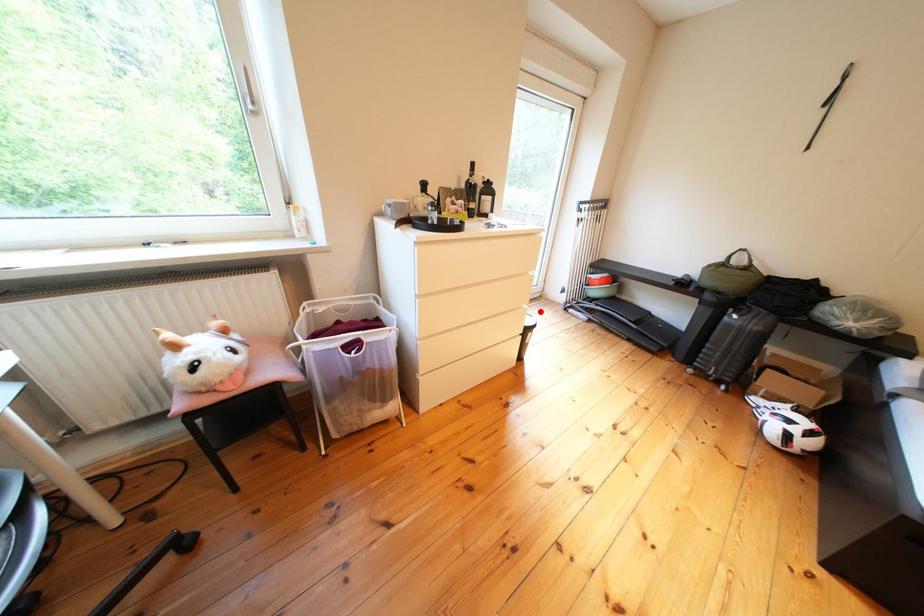
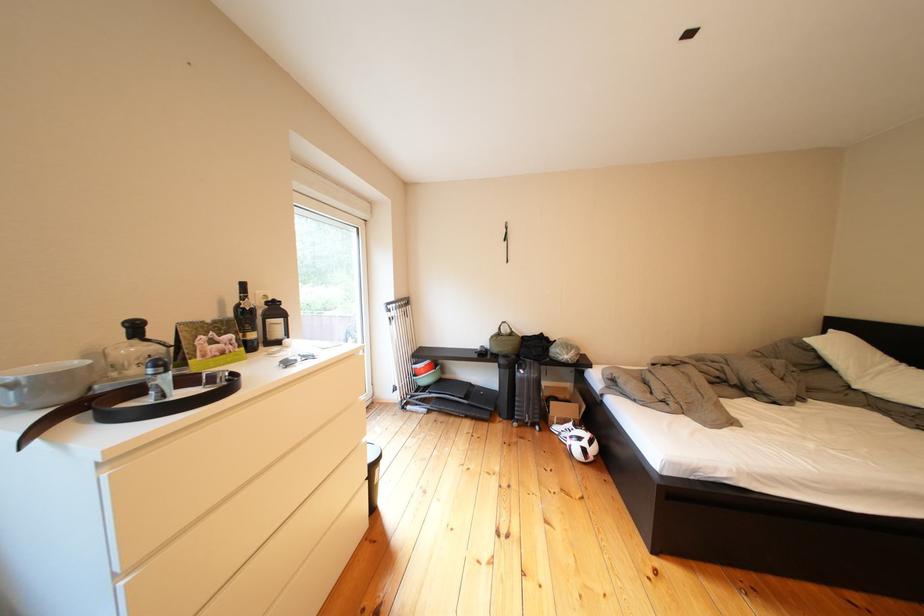
Question: I am providing you with two images of the same scene from different viewpoints. Image1 has a red point marked. In image2, the corresponding 3D location appears at what relative position? Reply with the corresponding letter.

Choices:
 (A) Closer
 (B) Farther

Answer: (A)